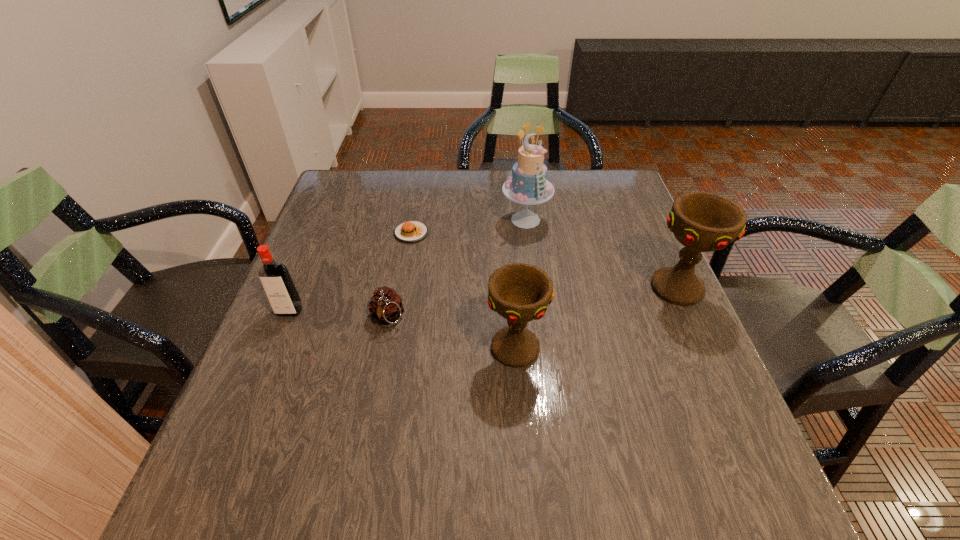
The image size is (960, 540). I want to click on free location at the right edge, so click(x=605, y=289).

Identify the location of free space at the far left corner. (369, 184).

At what (x,y) coordinates should I click in order to perform the action: click on vacant space at the near left corner. Please return your answer as a coordinate pair (x, y). Looking at the image, I should click on (236, 429).

Locate an element on the screen. free space at the far right corner of the desktop is located at coordinates (635, 202).

Locate an element on the screen. The image size is (960, 540). vacant space at the near right corner of the desktop is located at coordinates (662, 424).

Identify the location of free area in between the leftmost object and the cake. The height and width of the screenshot is (540, 960). (408, 266).

You are a GUI agent. You are given a task and a screenshot of the screen. Output one action in this format:
    pyautogui.click(x=<x>, y=<y>)
    Task: Click on the free space between the shortest object and the leftmost object
    This screenshot has width=960, height=540.
    Given the screenshot: What is the action you would take?
    pyautogui.click(x=350, y=272)

Where is `free spot between the pinecone and the vodka`? This screenshot has height=540, width=960. free spot between the pinecone and the vodka is located at coordinates (338, 314).

Locate an element on the screen. The width and height of the screenshot is (960, 540). empty location between the shortest object and the cake is located at coordinates (468, 226).

Find the location of `free area in between the cake and the vodka`. free area in between the cake and the vodka is located at coordinates (408, 266).